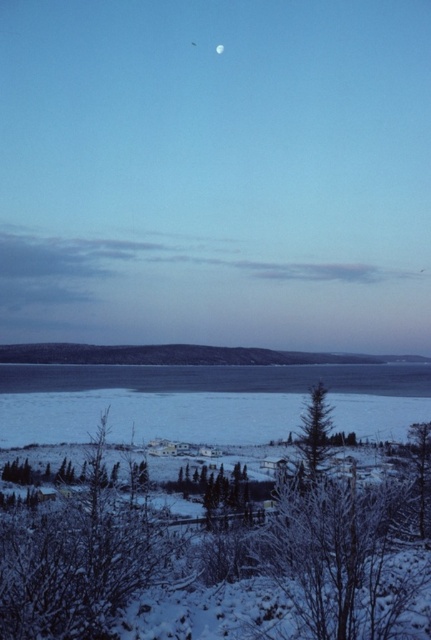
You are standing at the point labeled point (318, 468) and want to walk to the point labeled point (218, 44). Which direction should you face to move towards it?

Since point (318, 468) is closer to the viewer than point (218, 44), you should face towards the lower left direction to move towards the point (218, 44).

You are standing at the edge of the water and want to walk towards the frosty bark tree at lower left. Which direction should you move relative to the white ice at lower center?

You should move towards the lower left direction away from the white ice at lower center because the frosty bark tree at lower left is closer to you than the white ice at lower center.

You are an observer standing at the edge of the scene. You see the white ice at lower center and the frosty bark tree at lower left. Which object is closer to your current position?

The white ice at lower center is located below the frosty bark tree at lower left, so the white ice at lower center is closer to your current position.